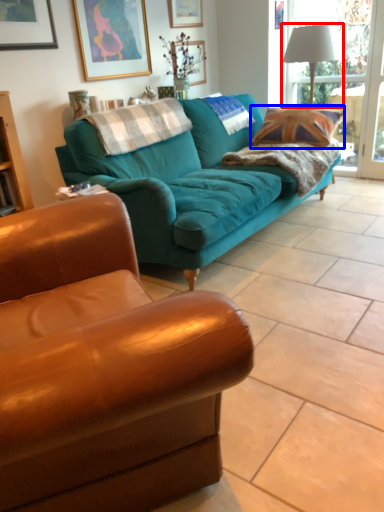
Question: Among these objects, which one is nearest to the camera, lamp (highlighted by a red box) or throw pillow (highlighted by a blue box)?

Choices:
 (A) lamp
 (B) throw pillow

Answer: (B)